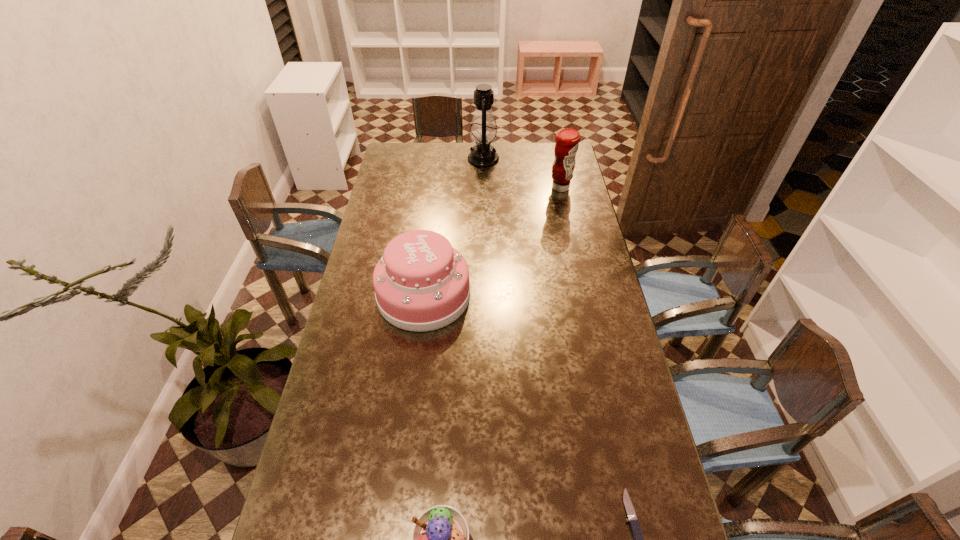
Select which object appears as the fourth closest to the second tallest object. Please provide its 2D coordinates. Your answer should be formatted as a tuple, i.e. [(x, y)], where the tuple contains the x and y coordinates of a point satisfying the conditions above.

[(440, 539)]

Point out which object is positioned as the third nearest to the shortest object. Please provide its 2D coordinates. Your answer should be formatted as a tuple, i.e. [(x, y)], where the tuple contains the x and y coordinates of a point satisfying the conditions above.

[(567, 140)]

Identify the location of free space that satisfies the following two spatial constraints: 1. on the back side of the cake; 2. on the left side of the condiment. Image resolution: width=960 pixels, height=540 pixels. (437, 188).

Locate an element on the screen. free region that satisfies the following two spatial constraints: 1. on the front side of the condiment; 2. on the left side of the tallest object is located at coordinates pos(484,188).

What are the coordinates of `vacant space that satisfies the following two spatial constraints: 1. on the back side of the third tallest object; 2. on the left side of the second farthest object` in the screenshot? It's located at (437, 188).